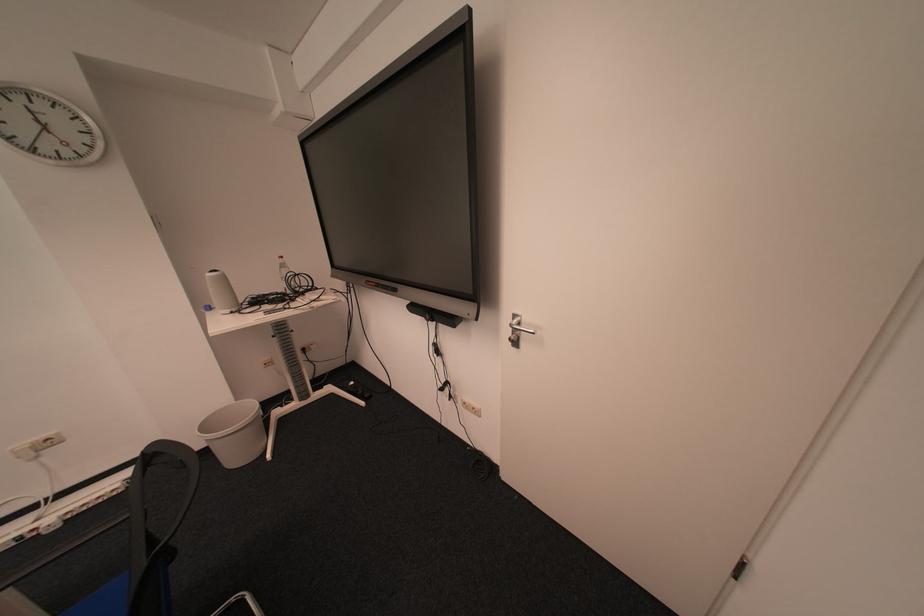
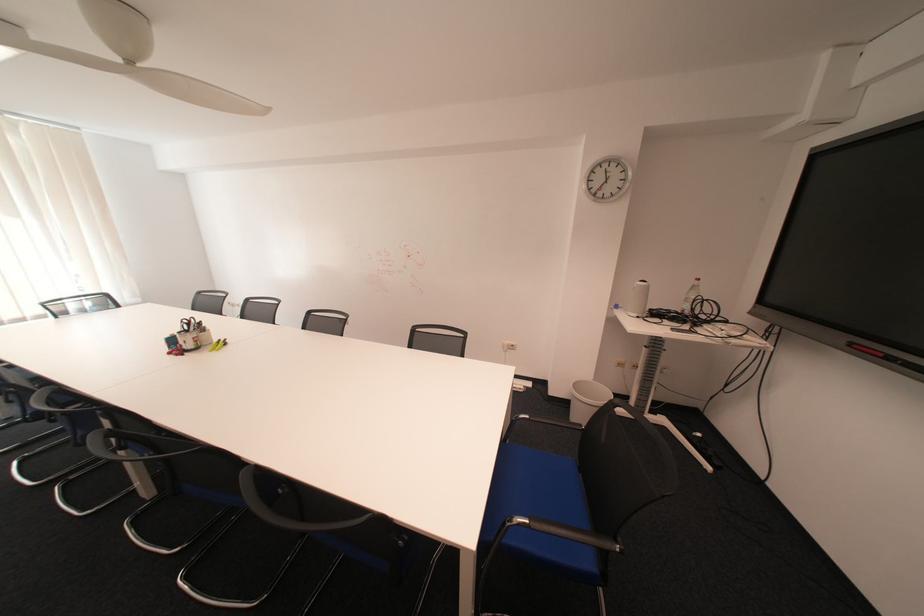
Question: The camera is either moving clockwise (left) or counter-clockwise (right) around the object. The first image is from the beginning of the video and the second image is from the end. Is the camera moving left or right when shooting the video?

Choices:
 (A) Left
 (B) Right

Answer: (B)